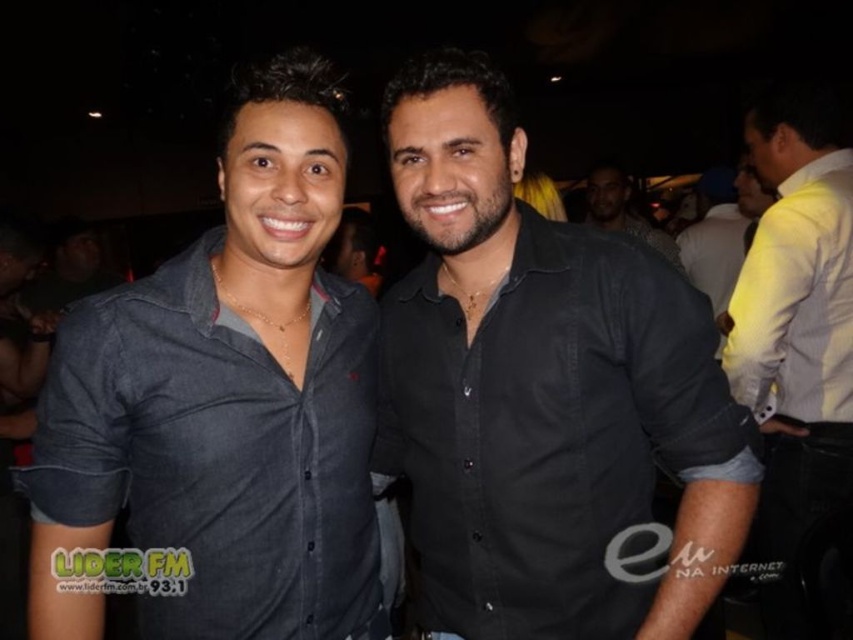
Question: Does black cotton shirt at center appear over black matte shirt at center?

Choices:
 (A) yes
 (B) no

Answer: (B)

Question: Considering the relative positions of black cotton shirt at center and black matte shirt at center in the image provided, where is black cotton shirt at center located with respect to black matte shirt at center?

Choices:
 (A) right
 (B) left

Answer: (B)

Question: Which point is closer to the camera?

Choices:
 (A) black matte shirt at center
 (B) black cotton shirt at center
 (C) denim shirt at center

Answer: (C)

Question: Which point is closer to the camera?

Choices:
 (A) (300, 100)
 (B) (834, 368)

Answer: (A)

Question: Which object is the closest to the black cotton shirt at center?

Choices:
 (A) denim shirt at center
 (B) black matte shirt at center
 (C) yellow cotton shirt at right

Answer: (A)

Question: Is black cotton shirt at center to the left of yellow cotton shirt at right from the viewer's perspective?

Choices:
 (A) no
 (B) yes

Answer: (B)